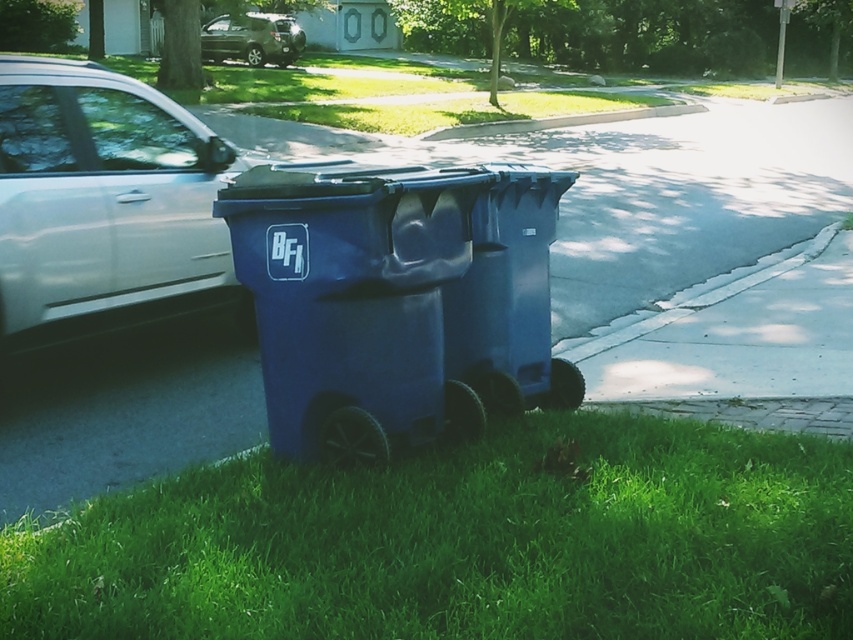
Is green grass at lower center positioned before satin silver car at left?

Yes.

From the picture: Between green grass at lower center and satin silver car at left, which one is positioned higher?

Positioned higher is satin silver car at left.

Measure the distance between green grass at lower center and camera.

green grass at lower center is 4.73 feet from camera.

What are the coordinates of `green grass at lower center` in the screenshot? It's located at (463, 541).

Is green grass at lower center positioned before blue plastic trash can at center?

Yes, green grass at lower center is closer to the viewer.

Can you confirm if green grass at lower center is taller than blue plastic trash can at center?

In fact, green grass at lower center may be shorter than blue plastic trash can at center.

Identify the location of green grass at lower center. The image size is (853, 640). (463, 541).

Between satin silver car at left and satin silver suv at upper center, which one is positioned lower?

satin silver car at left is below.

Can you confirm if satin silver car at left is wider than satin silver suv at upper center?

In fact, satin silver car at left might be narrower than satin silver suv at upper center.

Between point (10, 298) and point (212, 29), which one is positioned in front?

Point (10, 298)

Locate an element on the screen. The height and width of the screenshot is (640, 853). satin silver car at left is located at coordinates (105, 204).